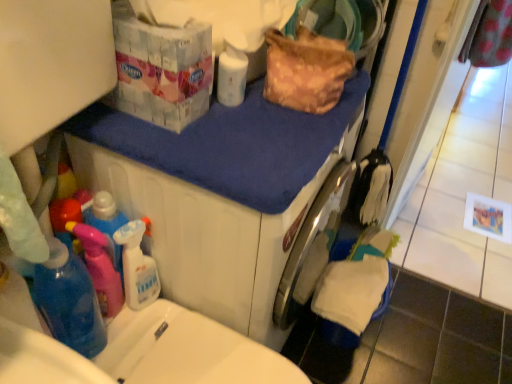
I want to click on vacant area located to the right-hand side of white glossy bottle at upper center, so click(290, 113).